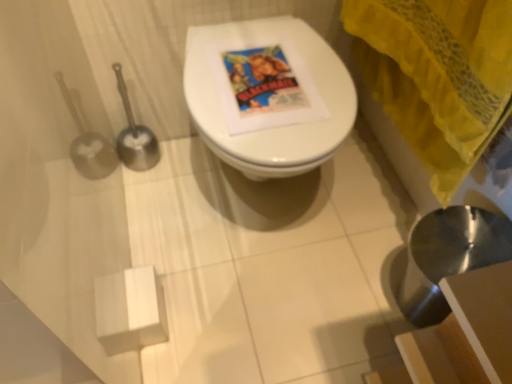
Question: Is metallic silver sink at lower right taller or shorter than yellow fabric curtain at upper right?

Choices:
 (A) short
 (B) tall

Answer: (B)

Question: Would you say metallic silver sink at lower right is inside or outside yellow fabric curtain at upper right?

Choices:
 (A) outside
 (B) inside

Answer: (A)

Question: Estimate the real-world distances between objects in this image. Which object is closer to the metallic silver sink at lower right?

Choices:
 (A) yellow fabric curtain at upper right
 (B) white glossy toilet at center

Answer: (A)

Question: Which of these objects is positioned closest to the yellow fabric curtain at upper right?

Choices:
 (A) white glossy toilet at center
 (B) metallic silver sink at lower right

Answer: (A)